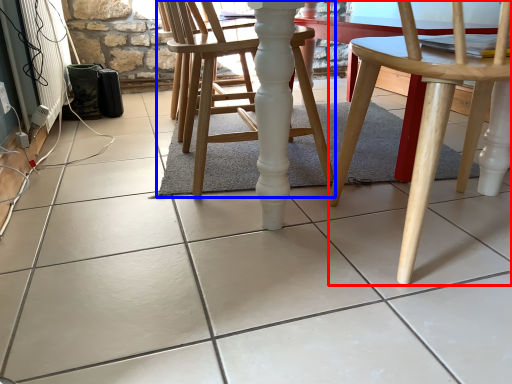
Question: Among these objects, which one is nearest to the camera, chair (highlighted by a red box) or chair (highlighted by a blue box)?

Choices:
 (A) chair
 (B) chair

Answer: (A)